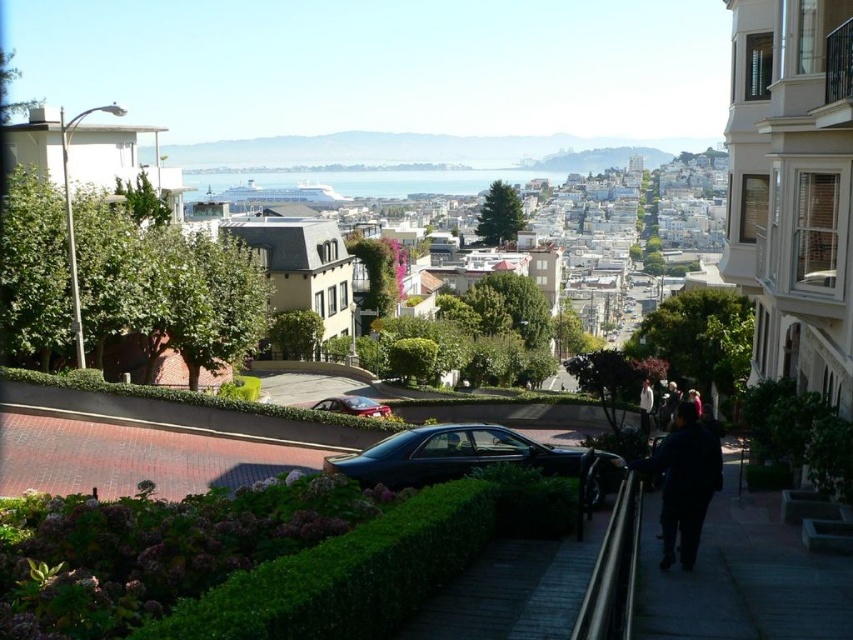
You are a delivery person trying to park your vehicle in the area shown. You see the glossy black car at center and the dark blue jacket at lower right. Which object is closer to the road where you are standing?

The glossy black car at center is positioned under dark blue jacket at lower right, meaning the car is closer to the road than the jacket.

You are standing at the point marked as point (132, 456) in the image. What type of surface are you standing on?

You are standing on brick pavement at lower left.

You are a pedestrian standing on the sidewalk and want to cross the road to reach the brick pavement at lower left. Which direction should you walk relative to the shiny red car at center?

The brick pavement at lower left is to the left of the shiny red car at center, so you should walk to the left of the shiny red car at center to reach it.